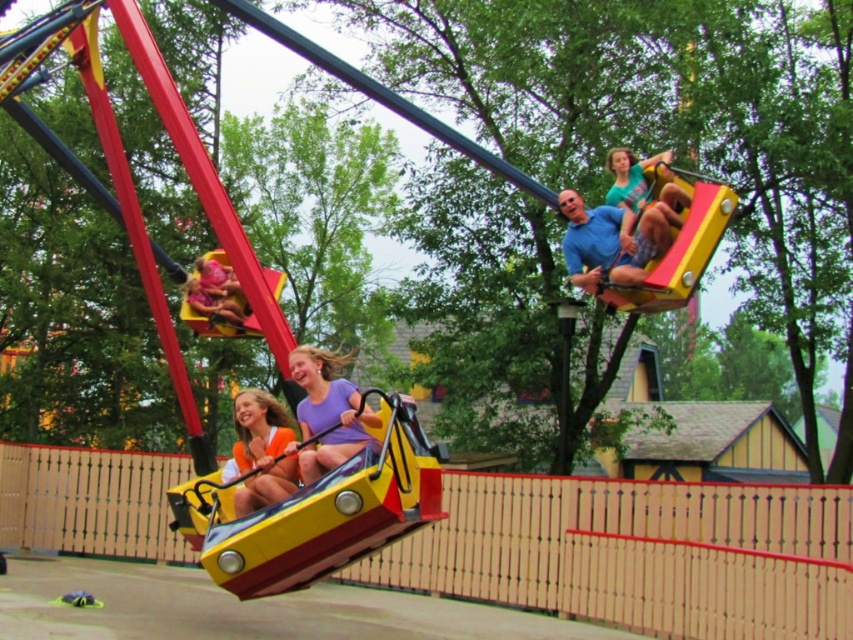
Can you confirm if orange fabric at lower center is positioned to the right of matte green shirt at upper right?

Incorrect, orange fabric at lower center is not on the right side of matte green shirt at upper right.

Can you confirm if orange fabric at lower center is positioned to the left of matte green shirt at upper right?

Yes, orange fabric at lower center is to the left of matte green shirt at upper right.

This screenshot has width=853, height=640. Identify the location of orange fabric at lower center. (260, 451).

Can you confirm if purple matte shirt at center is bigger than orange fabric at lower center?

Yes.

Is purple matte shirt at center further to the viewer compared to orange fabric at lower center?

No, purple matte shirt at center is in front of orange fabric at lower center.

I want to click on purple matte shirt at center, so click(x=328, y=412).

At what (x,y) coordinates should I click in order to perform the action: click on purple matte shirt at center. Please return your answer as a coordinate pair (x, y). This screenshot has width=853, height=640. Looking at the image, I should click on (328, 412).

Is point (335, 413) positioned after point (648, 237)?

No, it is in front of (648, 237).

What do you see at coordinates (328, 412) in the screenshot?
I see `purple matte shirt at center` at bounding box center [328, 412].

Who is more forward, (315, 396) or (654, 224)?

Point (315, 396) is in front.

The width and height of the screenshot is (853, 640). What are the coordinates of `purple matte shirt at center` in the screenshot? It's located at (328, 412).